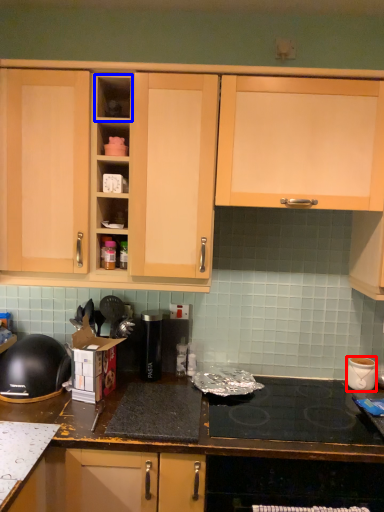
Question: Which point is closer to the camera, kitchen appliance (highlighted by a red box) or shelf (highlighted by a blue box)?

Choices:
 (A) kitchen appliance
 (B) shelf

Answer: (B)